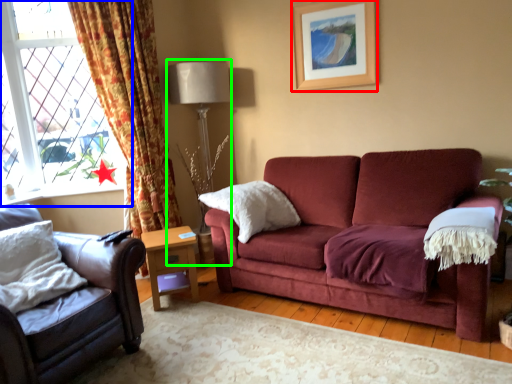
Question: Which object is positioned farthest from picture frame (highlighted by a red box)? Select from window (highlighted by a blue box) and table lamp (highlighted by a green box).

Choices:
 (A) window
 (B) table lamp

Answer: (A)